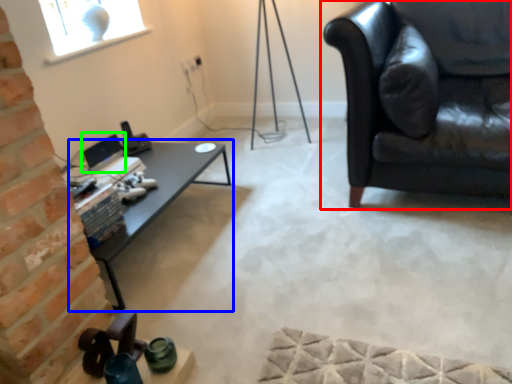
Question: Considering the real-world distances, which object is farthest from studio couch (highlighted by a red box)? table (highlighted by a blue box) or computer monitor (highlighted by a green box)?

Choices:
 (A) table
 (B) computer monitor

Answer: (B)